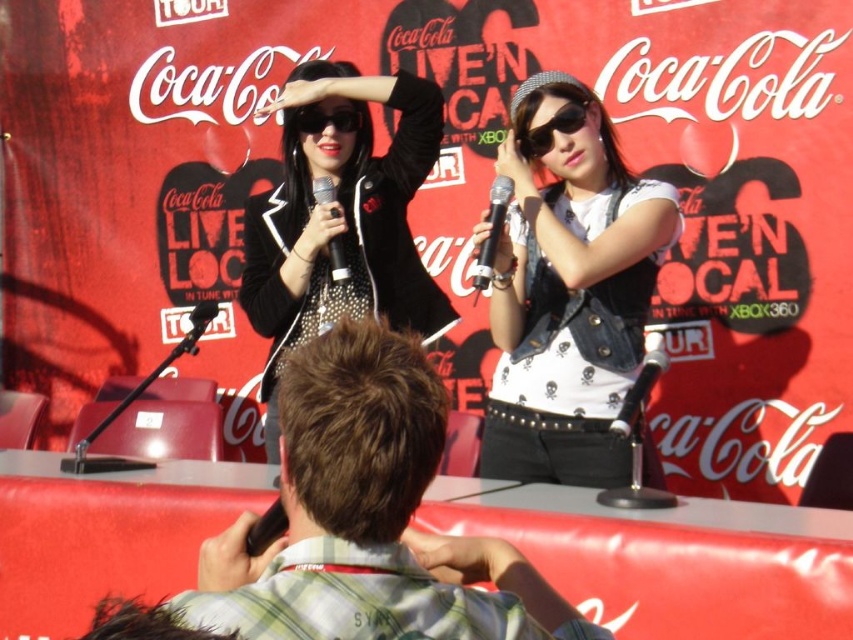
Which of these two, black matte microphone at center or black matte sunglasses at upper center, stands taller?

With more height is black matte microphone at center.

Is point (628, 417) in front of point (310, 132)?

Yes, point (628, 417) is closer to viewer.

Is point (651, 340) farther from camera compared to point (347, 113)?

That is True.

Image resolution: width=853 pixels, height=640 pixels. In order to click on black matte microphone at center in this screenshot , I will do `click(641, 384)`.

Is point (502, 570) behind point (538, 132)?

No, it is not.

What do you see at coordinates (367, 518) in the screenshot? The width and height of the screenshot is (853, 640). I see `plaid shirt at center` at bounding box center [367, 518].

Is point (198, 608) farther from viewer compared to point (585, 112)?

No, it is in front of (585, 112).

Where is `plaid shirt at center`? plaid shirt at center is located at coordinates (367, 518).

Does black matte microphone at center have a smaller size compared to black matte microphone at upper center?

Correct, black matte microphone at center occupies less space than black matte microphone at upper center.

Consider the image. Is black matte microphone at center bigger than black matte microphone at upper center?

No, black matte microphone at center is not bigger than black matte microphone at upper center.

The height and width of the screenshot is (640, 853). In order to click on black matte microphone at center in this screenshot , I will do `click(641, 384)`.

Where is `black matte microphone at center`? The image size is (853, 640). black matte microphone at center is located at coordinates (641, 384).